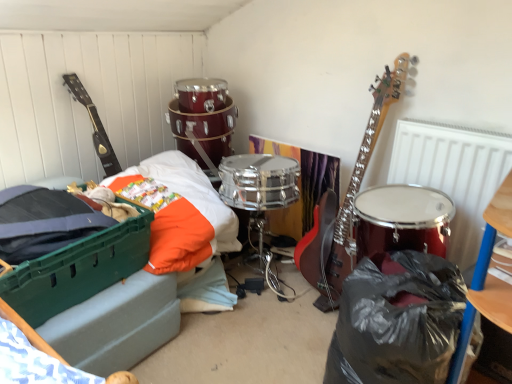
Question: Can you confirm if black plastic bag at lower right is bigger than black plastic bag at lower right?

Choices:
 (A) no
 (B) yes

Answer: (A)

Question: Is black plastic bag at lower right outside black plastic bag at lower right?

Choices:
 (A) yes
 (B) no

Answer: (A)

Question: From the image's perspective, does black plastic bag at lower right appear lower than black plastic bag at lower right?

Choices:
 (A) yes
 (B) no

Answer: (B)

Question: Could you tell me if black plastic bag at lower right is facing black plastic bag at lower right?

Choices:
 (A) no
 (B) yes

Answer: (B)

Question: Can you confirm if black plastic bag at lower right is shorter than black plastic bag at lower right?

Choices:
 (A) yes
 (B) no

Answer: (A)

Question: Is point (97, 135) closer or farther from the camera than point (472, 180)?

Choices:
 (A) farther
 (B) closer

Answer: (A)

Question: Considering the positions of matte black guitar at left and metallic silver radiator at upper right in the image, is matte black guitar at left taller or shorter than metallic silver radiator at upper right?

Choices:
 (A) short
 (B) tall

Answer: (A)

Question: Based on their positions, is matte black guitar at left located to the left or right of metallic silver radiator at upper right?

Choices:
 (A) right
 (B) left

Answer: (B)

Question: From the image's perspective, is matte black guitar at left above or below metallic silver radiator at upper right?

Choices:
 (A) below
 (B) above

Answer: (B)

Question: From their relative heights in the image, would you say green plastic bed at lower left is taller or shorter than matte black guitar at left?

Choices:
 (A) short
 (B) tall

Answer: (A)

Question: From a real-world perspective, is green plastic bed at lower left above or below matte black guitar at left?

Choices:
 (A) above
 (B) below

Answer: (B)

Question: Visually, is green plastic bed at lower left positioned to the left or to the right of matte black guitar at left?

Choices:
 (A) left
 (B) right

Answer: (B)

Question: Is green plastic bed at lower left bigger or smaller than matte black guitar at left?

Choices:
 (A) big
 (B) small

Answer: (A)

Question: Is metallic silver radiator at upper right inside the boundaries of matte black guitar at left, or outside?

Choices:
 (A) outside
 (B) inside

Answer: (A)

Question: Based on their positions, is metallic silver radiator at upper right located to the left or right of matte black guitar at left?

Choices:
 (A) right
 (B) left

Answer: (A)